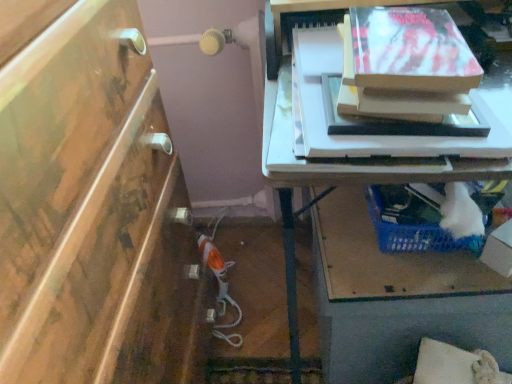
The width and height of the screenshot is (512, 384). What are the coordinates of `free space to the left of white cardboard box at lower right` in the screenshot? It's located at (428, 264).